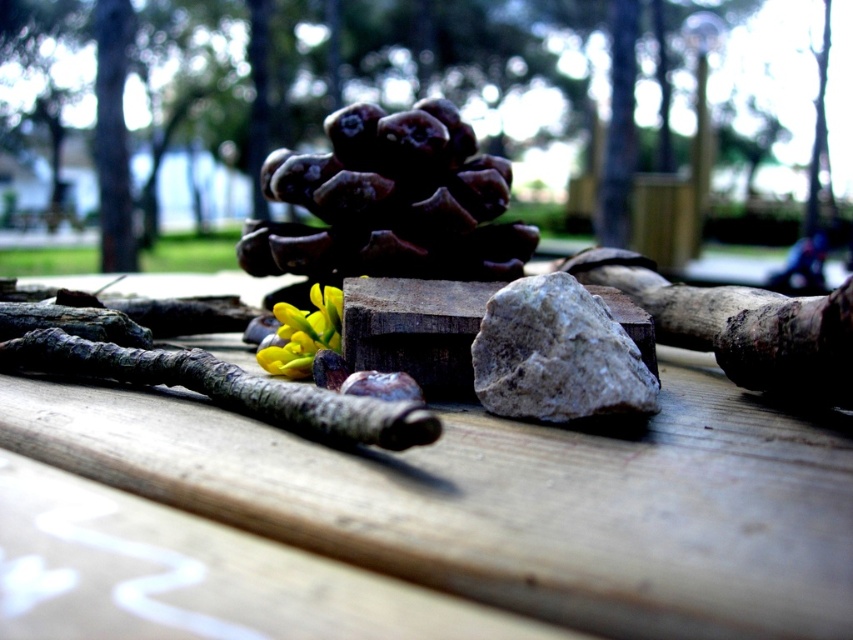
You are arranging items on a wooden table at center and a gray rough rock at center. If you want to place a small decorative item between them, where should you position it?

The wooden table at center is located below the gray rough rock at center, so you should place the small decorative item between them by positioning it above the wooden table at center and below the gray rough rock at center.

You are standing in front of the wooden surface with the natural arrangement. There are two points marked on the image at coordinates point (x=527, y=301) and point (x=79, y=358). Which point is closer to you?

Point (x=527, y=301) is closer to the viewer than point (x=79, y=358).

In the scene shown: You are standing in front of a wooden surface with several natural objects arranged on it. You notice a pine cone, a rock, and some twigs. Where exactly is the wooden table at center located in terms of coordinates?

The wooden table at center is located at coordinates point (514, 500).